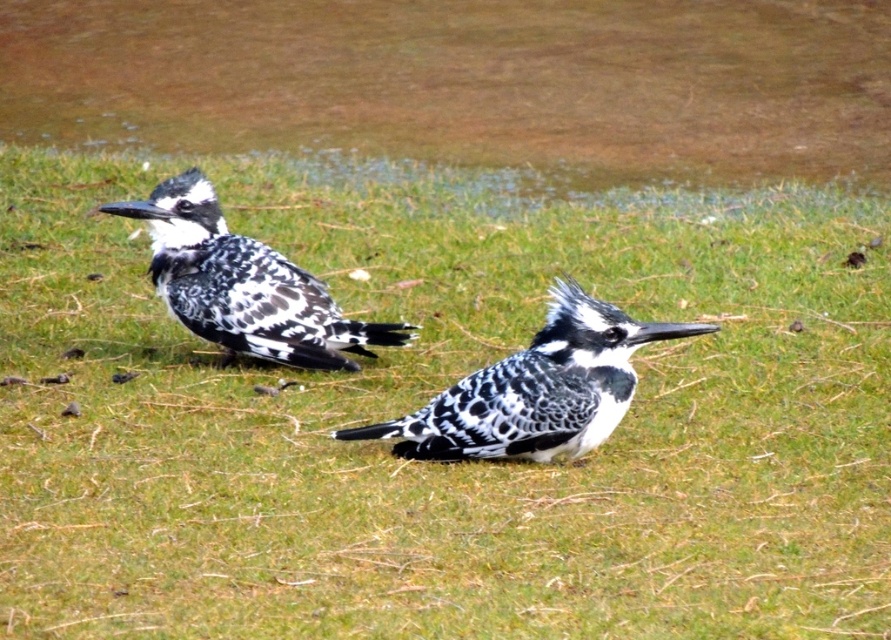
Question: In this image, where is speckled feathers bird at center located relative to speckled feathered bird at left?

Choices:
 (A) right
 (B) left

Answer: (A)

Question: Which object appears closest to the camera in this image?

Choices:
 (A) speckled feathers bird at center
 (B) speckled feathered bird at left

Answer: (A)

Question: Which point appears closest to the camera in this image?

Choices:
 (A) (275, 326)
 (B) (432, 438)

Answer: (B)

Question: Is speckled feathers bird at center bigger than speckled feathered bird at left?

Choices:
 (A) no
 (B) yes

Answer: (A)

Question: Does speckled feathers bird at center come in front of speckled feathered bird at left?

Choices:
 (A) yes
 (B) no

Answer: (A)